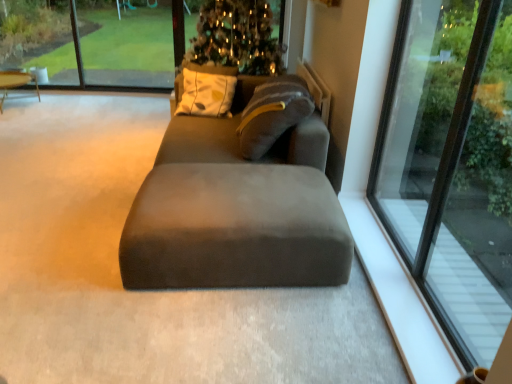
Question: Is suede-like gray studio couch at center in front of or behind matte brown table at left in the image?

Choices:
 (A) front
 (B) behind

Answer: (A)

Question: In terms of height, does suede-like gray studio couch at center look taller or shorter compared to matte brown table at left?

Choices:
 (A) tall
 (B) short

Answer: (A)

Question: Considering the real-world distances, which object is closest to the green glass window at upper left, which is the 1th window screen in left-to-right order?

Choices:
 (A) transparent glass window at right
 (B) suede-like gray studio couch at center
 (C) matte brown table at left
 (D) clear glass window at upper center, which ranks as the 1th window screen in right-to-left order

Answer: (D)

Question: Estimate the real-world distances between objects in this image. Which object is farther from the green glass window at upper left, which is the 1th window screen in left-to-right order?

Choices:
 (A) transparent glass window at right
 (B) suede-like gray studio couch at center
 (C) clear glass window at upper center, acting as the 2th window screen starting from the left
 (D) matte brown table at left

Answer: (A)